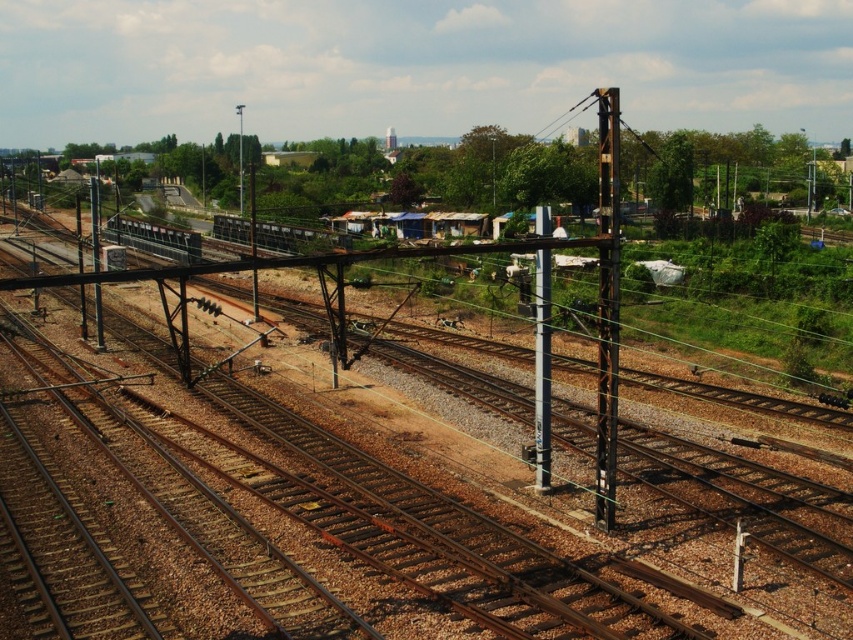
You are a maintenance worker inspecting the railway yard. You notice the rusty metal track at center and the shiny silver train at left. Which object is located below the other?

The rusty metal track at center is positioned under the shiny silver train at left, meaning the track is below the train.